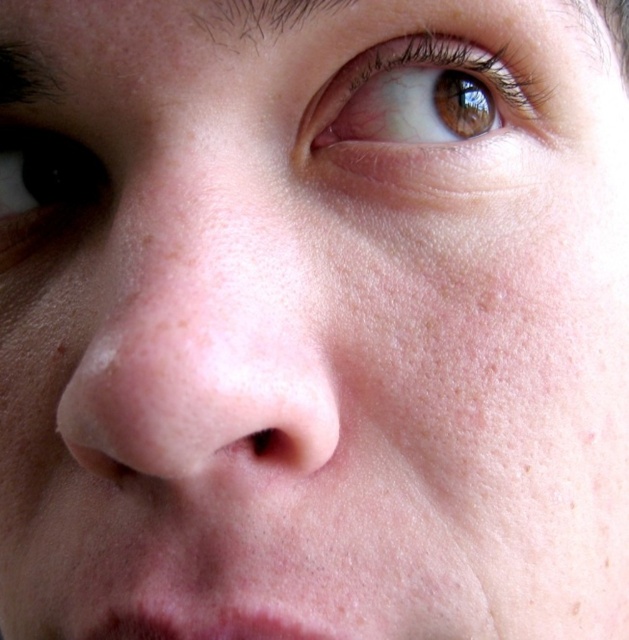
Can you confirm if pink matte lips at lower center is shorter than dark brown hair at upper left?

Yes.

Which of these two, pink matte lips at lower center or dark brown hair at upper left, stands taller?

Standing taller between the two is dark brown hair at upper left.

You are a GUI agent. You are given a task and a screenshot of the screen. Output one action in this format:
    pyautogui.click(x=<x>, y=<y>)
    Task: Click on the pink matte lips at lower center
    This screenshot has width=629, height=640.
    Given the screenshot: What is the action you would take?
    pyautogui.click(x=209, y=625)

You are a GUI agent. You are given a task and a screenshot of the screen. Output one action in this format:
    pyautogui.click(x=<x>, y=<y>)
    Task: Click on the pink matte lips at lower center
    
    Given the screenshot: What is the action you would take?
    pyautogui.click(x=209, y=625)

Does pink smooth nose at center have a greater height compared to dark brown hair at upper center?

Yes, pink smooth nose at center is taller than dark brown hair at upper center.

Is pink smooth nose at center above dark brown hair at upper center?

No.

Between point (152, 307) and point (276, 16), which one is positioned behind?

Positioned behind is point (276, 16).

You are a GUI agent. You are given a task and a screenshot of the screen. Output one action in this format:
    pyautogui.click(x=<x>, y=<y>)
    Task: Click on the pink smooth nose at center
    This screenshot has height=640, width=629.
    Given the screenshot: What is the action you would take?
    pyautogui.click(x=203, y=353)

Which of these two, pink smooth nose at center or brown glossy eye at upper center, stands shorter?

With less height is brown glossy eye at upper center.

Who is lower down, pink smooth nose at center or brown glossy eye at upper center?

Positioned lower is pink smooth nose at center.

Does point (213, 337) come closer to viewer compared to point (376, 65)?

Yes, point (213, 337) is in front of point (376, 65).

Locate an element on the screen. Image resolution: width=629 pixels, height=640 pixels. pink smooth nose at center is located at coordinates (203, 353).